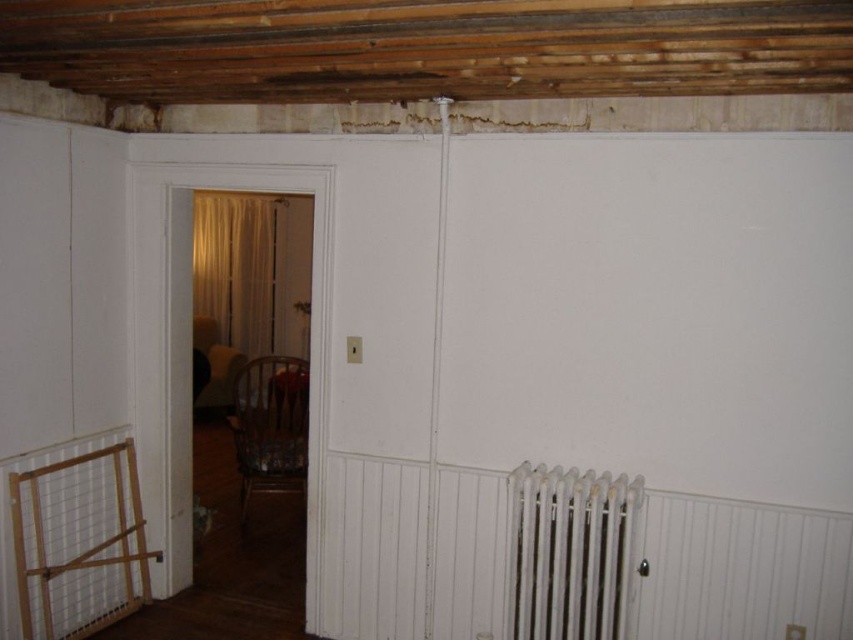
You are a contractor assessing the room for renovations. You need to install a new heating unit that requires more space than the existing white metal radiator at lower right. Can the beige sheer curtain at center area accommodate the new unit based on their sizes?

The white metal radiator at lower right occupies less space than the beige sheer curtain at center, so the beige sheer curtain at center area has enough space to accommodate the new heating unit.